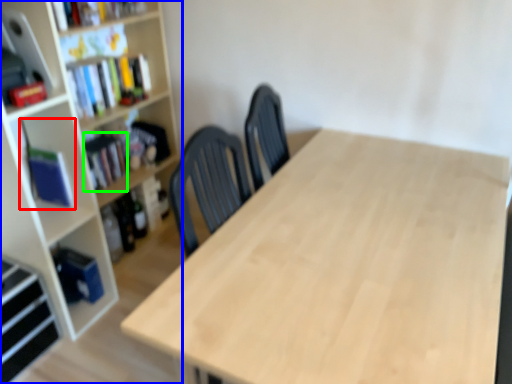
Question: Based on their relative distances, which object is nearer to book (highlighted by a red box)? Choose from bookcase (highlighted by a blue box) and book (highlighted by a green box).

Choices:
 (A) bookcase
 (B) book

Answer: (A)